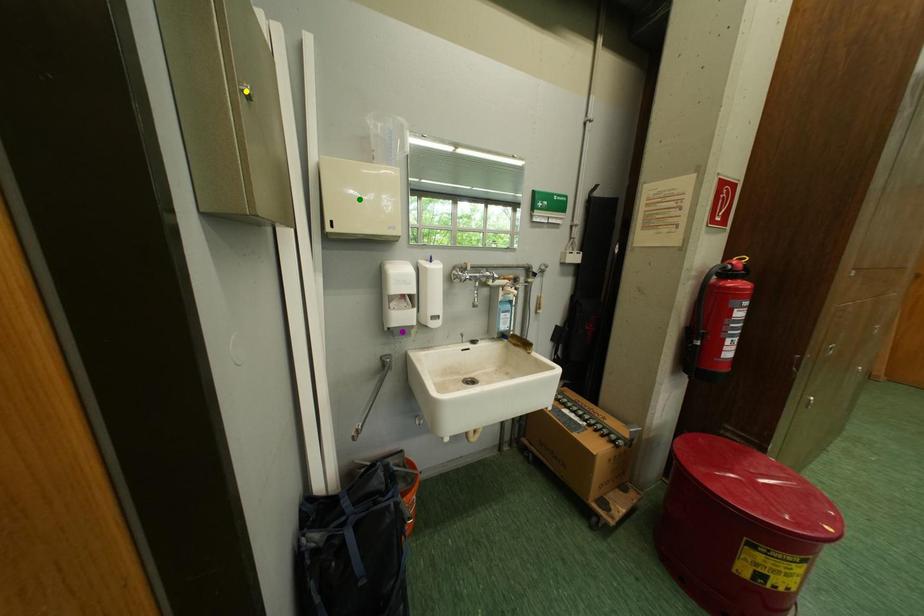
Order these from farthest to nearest:
A) purple point
B) green point
C) yellow point

purple point → green point → yellow point